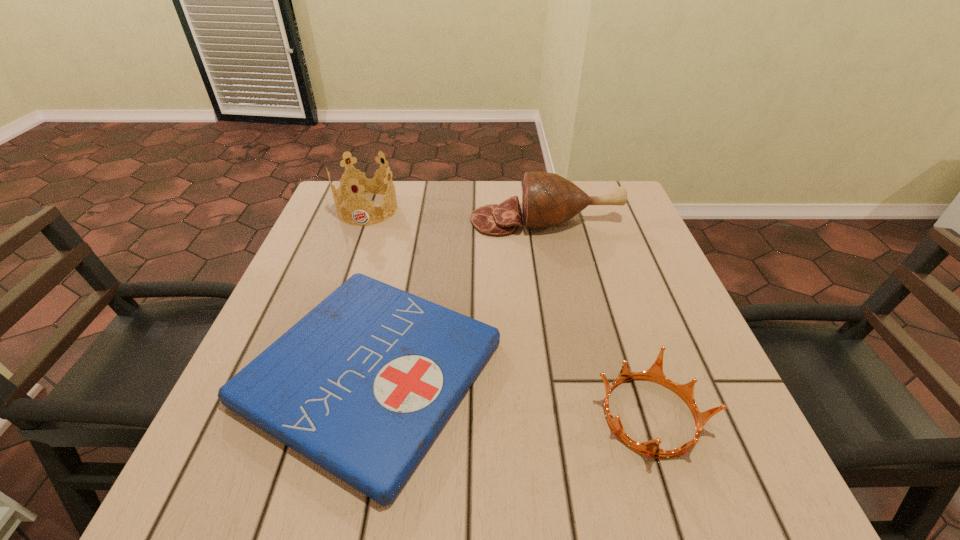
The height and width of the screenshot is (540, 960). Identify the location of object that is at the far left corner. (361, 180).

This screenshot has width=960, height=540. I want to click on object located in the near left corner section of the desktop, so click(362, 385).

Identify the location of object located in the far right corner section of the desktop. (548, 199).

Where is `object at the near right corner`? object at the near right corner is located at coordinates (651, 448).

You are a GUI agent. You are given a task and a screenshot of the screen. Output one action in this format:
    pyautogui.click(x=<x>, y=<y>)
    Task: Click on the vacant space at the far edge of the desktop
    This screenshot has width=960, height=540.
    Given the screenshot: What is the action you would take?
    pyautogui.click(x=484, y=184)

The height and width of the screenshot is (540, 960). I want to click on vacant space at the near edge of the desktop, so click(x=419, y=480).

At what (x,y) coordinates should I click in order to perform the action: click on free space at the left edge of the desktop. Please return your answer as a coordinate pair (x, y). Image resolution: width=960 pixels, height=540 pixels. Looking at the image, I should click on (323, 248).

Where is `blank space at the right edge`? This screenshot has width=960, height=540. blank space at the right edge is located at coordinates (613, 286).

Find the location of a particular element. Image resolution: width=960 pixels, height=540 pixels. vacant region at the far left corner of the desktop is located at coordinates (333, 220).

I want to click on vacant space at the near right corner of the desktop, so click(744, 454).